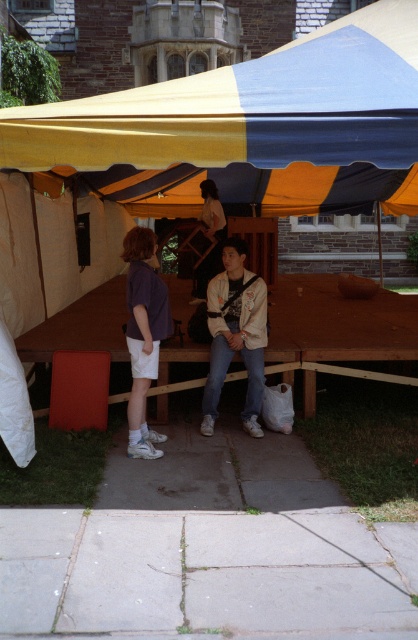
Does yellow fabric canopy at upper center have a smaller size compared to purple fabric shirt at center?

No.

Is yellow fabric canopy at upper center shorter than purple fabric shirt at center?

Incorrect, yellow fabric canopy at upper center's height does not fall short of purple fabric shirt at center's.

Is point (301, 38) in front of point (135, 246)?

No, it is not.

The image size is (418, 640). What are the coordinates of `yellow fabric canopy at upper center` in the screenshot? It's located at (249, 128).

Which is more to the left, yellow fabric tent at center or brown wooden picnic table at center?

From the viewer's perspective, brown wooden picnic table at center appears more on the left side.

Is point (382, 93) positioned behind point (354, 305)?

No, it is in front of (354, 305).

I want to click on yellow fabric tent at center, so click(x=249, y=128).

Between purple fabric shirt at center and matte white shirt at center, which one appears on the right side from the viewer's perspective?

From the viewer's perspective, matte white shirt at center appears more on the right side.

Does purple fabric shirt at center have a smaller size compared to matte white shirt at center?

Correct, purple fabric shirt at center occupies less space than matte white shirt at center.

Measure the distance between point [162,314] and camera.

Point [162,314] and camera are 5.33 meters apart.

This screenshot has width=418, height=640. Find the location of `purple fabric shirt at center`. purple fabric shirt at center is located at coordinates (143, 336).